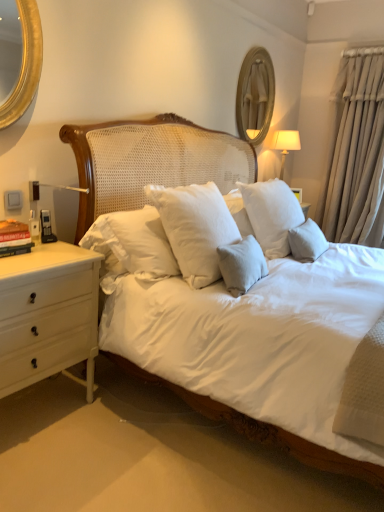
Question: Can you confirm if hardcover book at left is bigger than wooden framed mirror at upper center?

Choices:
 (A) no
 (B) yes

Answer: (A)

Question: Is hardcover book at left oriented towards wooden framed mirror at upper center?

Choices:
 (A) no
 (B) yes

Answer: (A)

Question: Does hardcover book at left appear on the right side of wooden framed mirror at upper center?

Choices:
 (A) no
 (B) yes

Answer: (A)

Question: Can you confirm if hardcover book at left is smaller than wooden framed mirror at upper center?

Choices:
 (A) yes
 (B) no

Answer: (A)

Question: Is hardcover book at left placed right next to wooden framed mirror at upper center?

Choices:
 (A) no
 (B) yes

Answer: (A)

Question: Is wooden framed mirror at upper center completely or partially inside hardcover book at left?

Choices:
 (A) yes
 (B) no

Answer: (B)

Question: Does wooden framed mirror at upper center have a lesser width compared to beige fabric curtain at right?

Choices:
 (A) yes
 (B) no

Answer: (A)

Question: Is wooden framed mirror at upper center smaller than beige fabric curtain at right?

Choices:
 (A) yes
 (B) no

Answer: (A)

Question: Is wooden framed mirror at upper center facing away from beige fabric curtain at right?

Choices:
 (A) yes
 (B) no

Answer: (B)

Question: Does wooden framed mirror at upper center have a larger size compared to beige fabric curtain at right?

Choices:
 (A) no
 (B) yes

Answer: (A)

Question: Is wooden framed mirror at upper center to the right of beige fabric curtain at right from the viewer's perspective?

Choices:
 (A) yes
 (B) no

Answer: (B)

Question: Would you say beige fabric curtain at right is part of wooden framed mirror at upper center's contents?

Choices:
 (A) no
 (B) yes

Answer: (A)

Question: From a real-world perspective, does beige fabric curtain at right sit lower than wooden framed mirror at upper center?

Choices:
 (A) yes
 (B) no

Answer: (A)